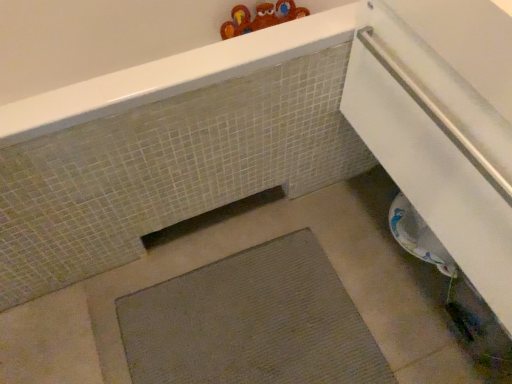
The image size is (512, 384). Identify the location of vacant location behind gray textured bath mat at center. (260, 224).